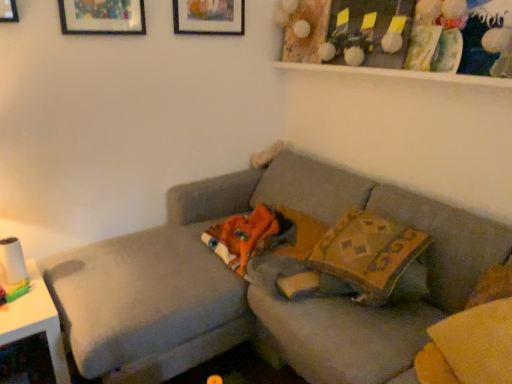
Question: From a real-world perspective, is matte wooden picture frame at upper center below textured gray couch at center?

Choices:
 (A) no
 (B) yes

Answer: (A)

Question: Can you confirm if matte wooden picture frame at upper center is bigger than textured gray couch at center?

Choices:
 (A) yes
 (B) no

Answer: (B)

Question: Is matte wooden picture frame at upper center oriented away from textured gray couch at center?

Choices:
 (A) no
 (B) yes

Answer: (A)

Question: Does matte wooden picture frame at upper center appear on the right side of textured gray couch at center?

Choices:
 (A) no
 (B) yes

Answer: (A)

Question: Is matte wooden picture frame at upper center next to textured gray couch at center and touching it?

Choices:
 (A) yes
 (B) no

Answer: (B)

Question: Looking at the image, does patterned fabric pillow at center seem bigger or smaller compared to white glossy table at left?

Choices:
 (A) small
 (B) big

Answer: (A)

Question: Considering the positions of patterned fabric pillow at center and white glossy table at left in the image, is patterned fabric pillow at center taller or shorter than white glossy table at left?

Choices:
 (A) tall
 (B) short

Answer: (B)

Question: Considering the positions of patterned fabric pillow at center and white glossy table at left in the image, is patterned fabric pillow at center wider or thinner than white glossy table at left?

Choices:
 (A) wide
 (B) thin

Answer: (B)

Question: Is patterned fabric pillow at center inside or outside of white glossy table at left?

Choices:
 (A) inside
 (B) outside

Answer: (B)

Question: From a real-world perspective, relative to patterned fabric pillow at center, is matte wooden picture frame at upper center vertically above or below?

Choices:
 (A) below
 (B) above

Answer: (B)

Question: Would you say matte wooden picture frame at upper center is to the left or to the right of patterned fabric pillow at center in the picture?

Choices:
 (A) left
 (B) right

Answer: (A)

Question: Is matte wooden picture frame at upper center in front of or behind patterned fabric pillow at center in the image?

Choices:
 (A) behind
 (B) front

Answer: (A)

Question: Looking at their shapes, would you say matte wooden picture frame at upper center is wider or thinner than patterned fabric pillow at center?

Choices:
 (A) wide
 (B) thin

Answer: (B)

Question: From the image's perspective, is textured gray couch at center above or below patterned fabric pillow at center?

Choices:
 (A) below
 (B) above

Answer: (A)

Question: Is textured gray couch at center spatially inside patterned fabric pillow at center, or outside of it?

Choices:
 (A) outside
 (B) inside

Answer: (A)